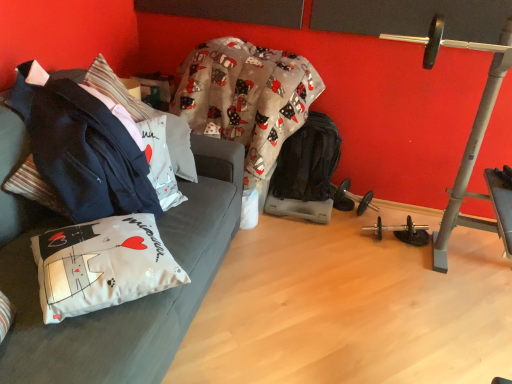
Question: Is dark blue fabric jacket at left at the left side of white fabric couch at left?

Choices:
 (A) yes
 (B) no

Answer: (B)

Question: From the image's perspective, is dark blue fabric jacket at left below white fabric couch at left?

Choices:
 (A) no
 (B) yes

Answer: (A)

Question: Is dark blue fabric jacket at left taller than white fabric couch at left?

Choices:
 (A) no
 (B) yes

Answer: (A)

Question: Is the position of dark blue fabric jacket at left less distant than that of white fabric couch at left?

Choices:
 (A) no
 (B) yes

Answer: (A)

Question: Is dark blue fabric jacket at left behind white fabric couch at left?

Choices:
 (A) yes
 (B) no

Answer: (A)

Question: Is black rubber dumbbell at lower center in front of or behind dark blue fabric jacket at left in the image?

Choices:
 (A) front
 (B) behind

Answer: (B)

Question: Considering the positions of black rubber dumbbell at lower center and dark blue fabric jacket at left in the image, is black rubber dumbbell at lower center bigger or smaller than dark blue fabric jacket at left?

Choices:
 (A) big
 (B) small

Answer: (B)

Question: Is point (376, 208) positioned closer to the camera than point (84, 178)?

Choices:
 (A) farther
 (B) closer

Answer: (A)

Question: Based on their positions, is black rubber dumbbell at lower center located to the left or right of dark blue fabric jacket at left?

Choices:
 (A) right
 (B) left

Answer: (A)

Question: From the image's perspective, is dark blue fabric jacket at left above or below white fabric pillow at center, which is the 2th pillow from bottom to top?

Choices:
 (A) above
 (B) below

Answer: (B)

Question: Based on their positions, is dark blue fabric jacket at left located to the left or right of white fabric pillow at center, which is the 2th pillow from bottom to top?

Choices:
 (A) right
 (B) left

Answer: (B)

Question: From a real-world perspective, is dark blue fabric jacket at left above or below white fabric pillow at center, the 2th pillow viewed from the front?

Choices:
 (A) below
 (B) above

Answer: (B)

Question: Does point (110, 183) appear closer or farther from the camera than point (143, 107)?

Choices:
 (A) closer
 (B) farther

Answer: (A)

Question: Looking at their shapes, would you say white fabric pillow at center, positioned as the first pillow in back-to-front order, is wider or thinner than white fabric couch at left?

Choices:
 (A) thin
 (B) wide

Answer: (A)

Question: From a real-world perspective, is white fabric pillow at center, positioned as the first pillow in back-to-front order, above or below white fabric couch at left?

Choices:
 (A) above
 (B) below

Answer: (A)